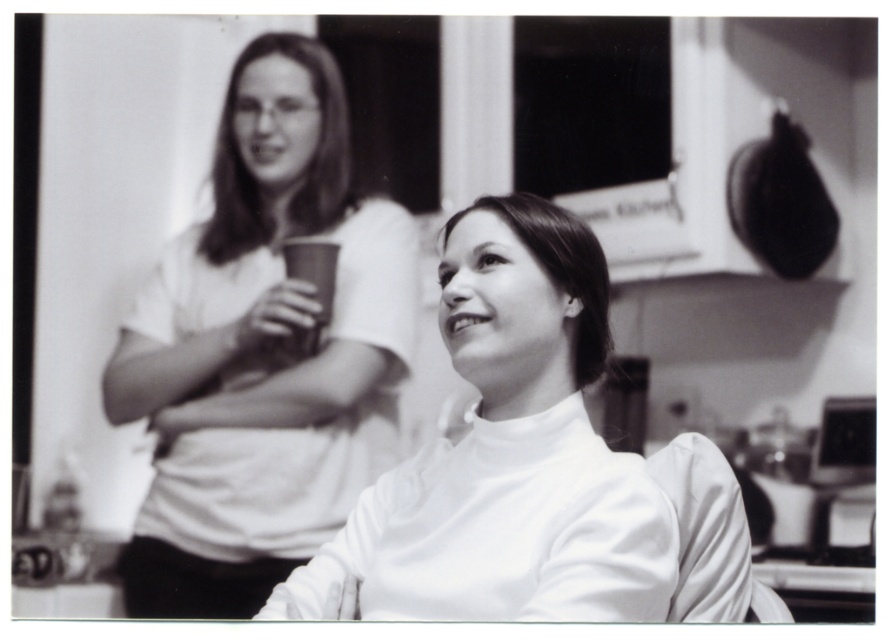
Question: Which object is farther from the camera taking this photo?

Choices:
 (A) white matte turtleneck at center
 (B) matte white shirt at upper left

Answer: (B)

Question: Is matte white shirt at upper left thinner than white matte turtleneck at center?

Choices:
 (A) yes
 (B) no

Answer: (B)

Question: Which point appears closest to the camera in this image?

Choices:
 (A) (350, 468)
 (B) (524, 532)

Answer: (B)

Question: Is matte white shirt at upper left smaller than white matte turtleneck at center?

Choices:
 (A) yes
 (B) no

Answer: (B)

Question: Can you confirm if matte white shirt at upper left is bigger than white matte turtleneck at center?

Choices:
 (A) yes
 (B) no

Answer: (A)

Question: Which of the following is the closest to the observer?

Choices:
 (A) matte white shirt at upper left
 (B) white matte turtleneck at center

Answer: (B)